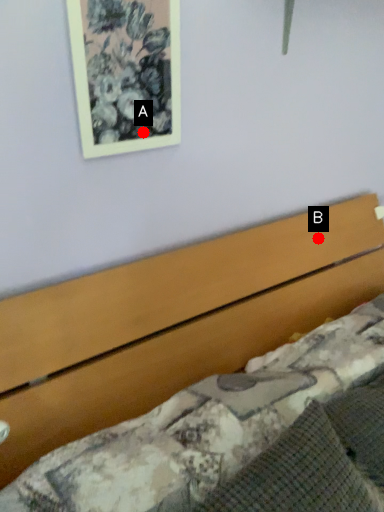
Question: Two points are circled on the image, labeled by A and B beside each circle. Which point is closer to the camera?

Choices:
 (A) A is closer
 (B) B is closer

Answer: (A)